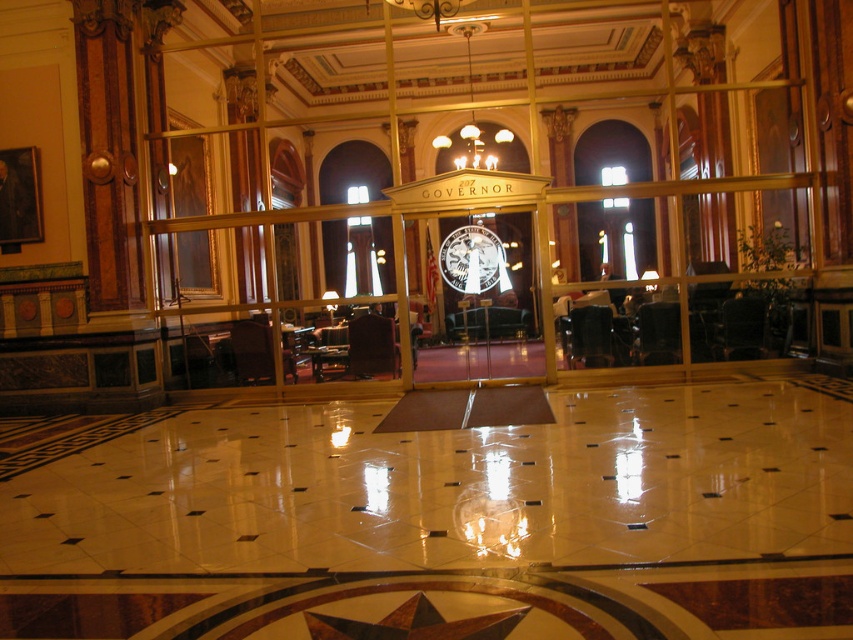
You are an interior designer planning to install a new lighting fixture. You observe the wooden star at center and the gold metallic chandelier at upper center. Which object is narrower in width?

The wooden star at center has a lesser width compared to the gold metallic chandelier at upper center, so the wooden star at center is narrower in width.

You are an interior designer planning to place a new rectangular table in the room. The table is 1.2 meters wide. You want to position it between the metallic silver clock at center and the gold metallic chandelier at upper center. Based on the spatial relationship between these two objects, will the table fit horizontally between them?

The metallic silver clock at center is narrower than the gold metallic chandelier at upper center. Since the table is 1.2 meters wide, and the space between them is determined by the chandelier being wider, the table should fit horizontally as the available width is sufficient.